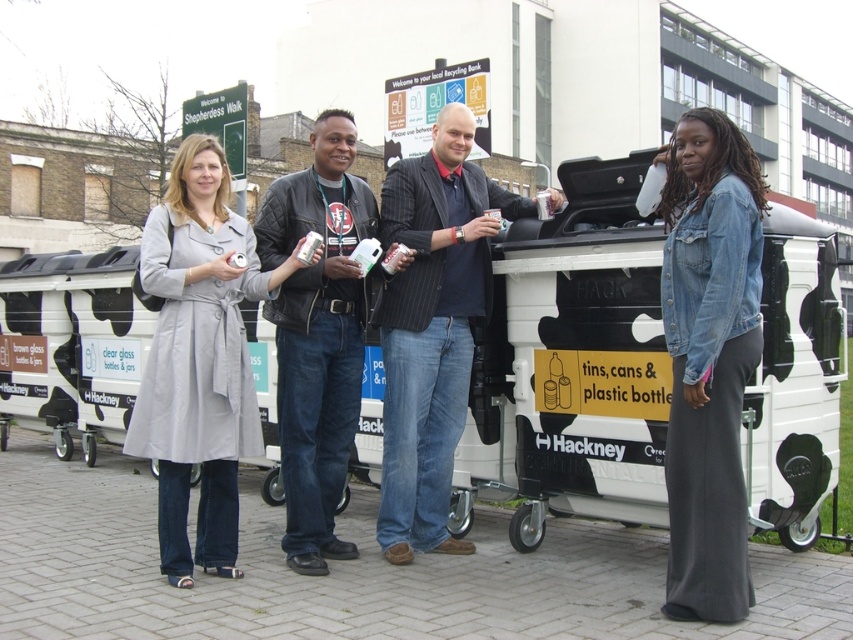
Question: Among these points, which one is nearest to the camera?

Choices:
 (A) (776, 321)
 (B) (735, 573)
 (C) (334, 380)

Answer: (B)

Question: Estimate the real-world distances between objects in this image. Which object is farther from the black leather jacket at center?

Choices:
 (A) dark blue pinstripe blazer at center
 (B) white plastic container at center

Answer: (B)

Question: Does white plastic container at center have a larger size compared to light gray coat at center?

Choices:
 (A) yes
 (B) no

Answer: (A)

Question: Which of the following is the farthest from the observer?

Choices:
 (A) (721, 301)
 (B) (524, 292)

Answer: (B)

Question: Can you confirm if denim jacket at lower right is wider than black leather jacket at center?

Choices:
 (A) no
 (B) yes

Answer: (B)

Question: Can you confirm if light gray coat at center is positioned above dark blue pinstripe blazer at center?

Choices:
 (A) no
 (B) yes

Answer: (A)